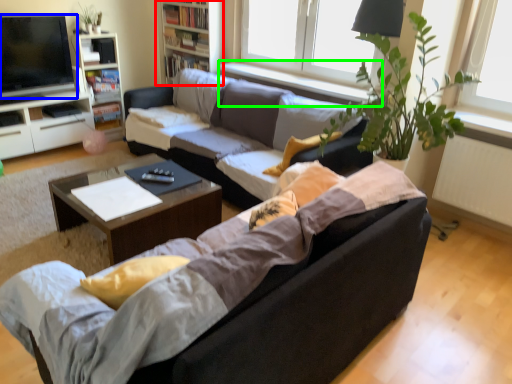
Question: Estimate the real-world distances between objects in this image. Which object is closer to bookshelf (highlighted by a red box), television (highlighted by a blue box) or window sill (highlighted by a green box)?

Choices:
 (A) television
 (B) window sill

Answer: (B)